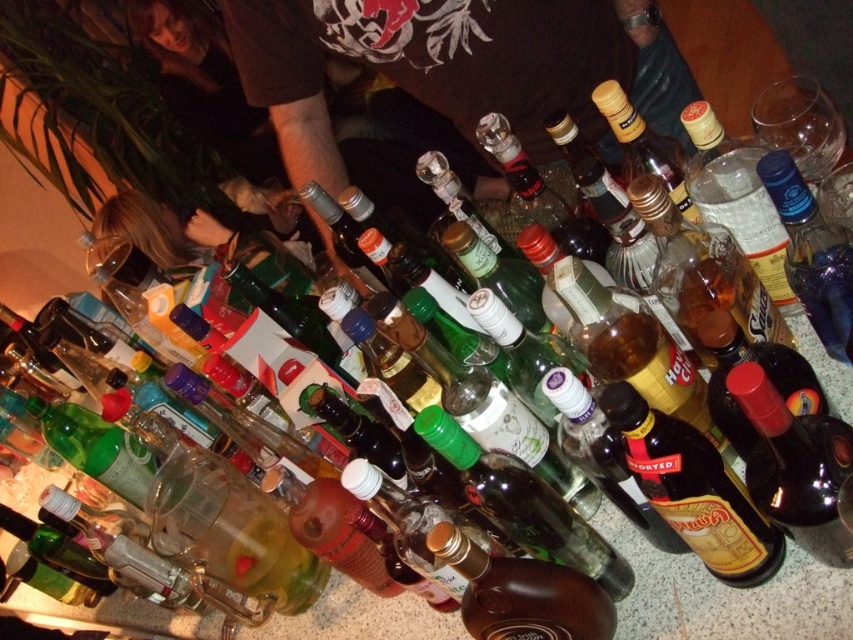
You are a bartender preparing a cocktail and need to choose between the amber glass bottle at center and the shiny dark red bottle at center based on their sizes. Which bottle should you pick if you need a larger one for the cocktail?

The amber glass bottle at center is larger in size than the shiny dark red bottle at center, so you should pick the amber glass bottle at center for the cocktail.